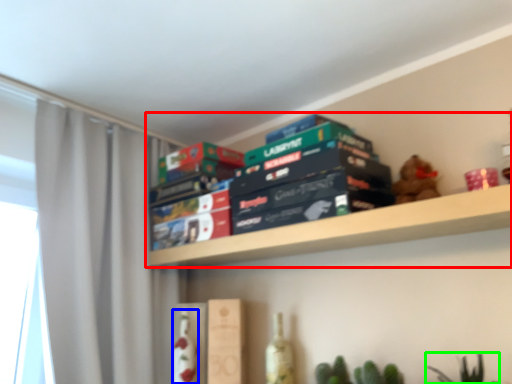
Question: Estimate the real-world distances between objects in this image. Which object is farther from shelf (highlighted by a red box), bottle (highlighted by a blue box) or plant (highlighted by a green box)?

Choices:
 (A) bottle
 (B) plant

Answer: (A)